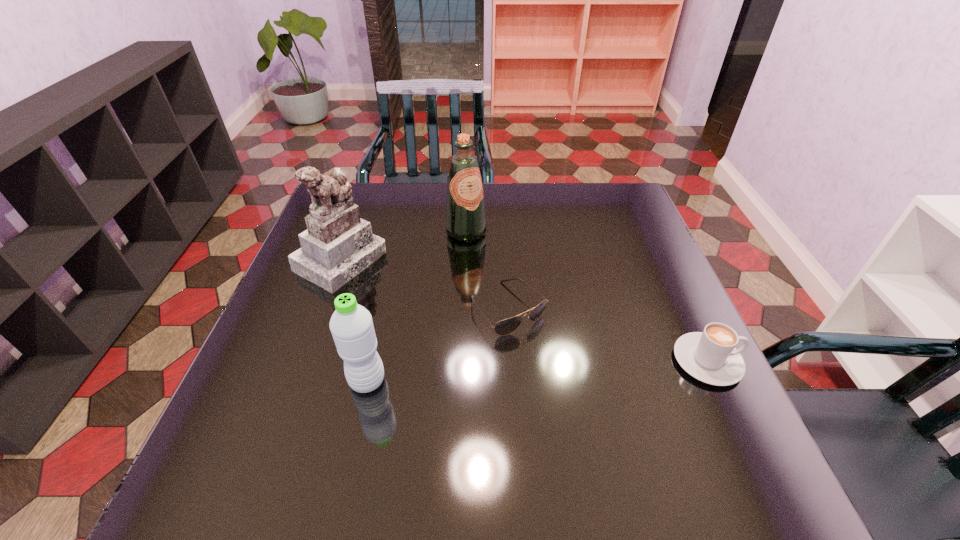
What are the coordinates of `free space between the cappuccino and the figurine` in the screenshot? It's located at (524, 310).

The height and width of the screenshot is (540, 960). In order to click on free point between the figurine and the sunglasses in this screenshot , I will do `click(424, 284)`.

At what (x,y) coordinates should I click in order to perform the action: click on vacant point located between the water bottle and the olive oil. Please return your answer as a coordinate pair (x, y). The width and height of the screenshot is (960, 540). Looking at the image, I should click on (417, 306).

Select which object is the third closest to the third shortest object. Please provide its 2D coordinates. Your answer should be formatted as a tuple, i.e. [(x, y)], where the tuple contains the x and y coordinates of a point satisfying the conditions above.

[(465, 212)]

Locate an element on the screen. This screenshot has width=960, height=540. object that stands as the third closest to the third shortest object is located at coordinates (465, 212).

This screenshot has width=960, height=540. Identify the location of free spot that satisfies the following two spatial constraints: 1. on the back side of the rightmost object; 2. to the right of the third tallest object. (372, 361).

The image size is (960, 540). I want to click on free space that satisfies the following two spatial constraints: 1. on the front side of the figurine; 2. on the right side of the shortest object, so click(x=324, y=308).

The height and width of the screenshot is (540, 960). Identify the location of free location that satisfies the following two spatial constraints: 1. on the front side of the figurine; 2. on the left side of the shortest object. (324, 308).

What are the coordinates of `vacant position in the image that satisfies the following two spatial constraints: 1. on the front side of the olive oil; 2. to the right of the fourth tallest object` in the screenshot? It's located at (461, 361).